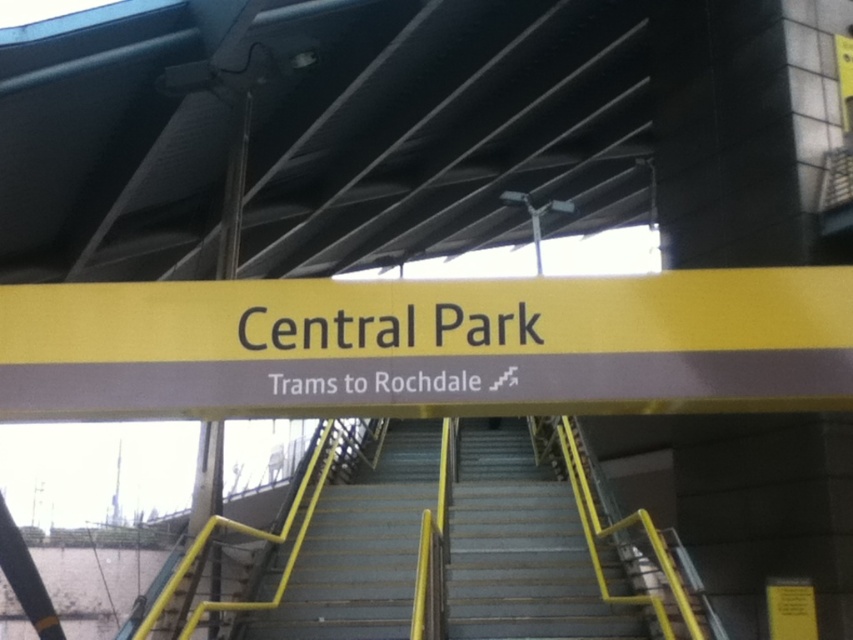
You are standing on the platform at Central Park station and see both the gray concrete stairs at center and the metallic gray stairs at center. Which set of stairs is nearer to you?

The gray concrete stairs at center is closer to the viewer than the metallic gray stairs at center, so the gray concrete stairs at center is nearer to you.

You are a maintenance worker tasked with ensuring all stairs at Central Park station meet safety standards. You notice two sets of stairs at the center of the platform. According to the provided image, which set of stairs, the gray concrete stairs at center or the metallic gray stairs at center, has a wider width?

The gray concrete stairs at center has a larger width than the metallic gray stairs at center according to the description.